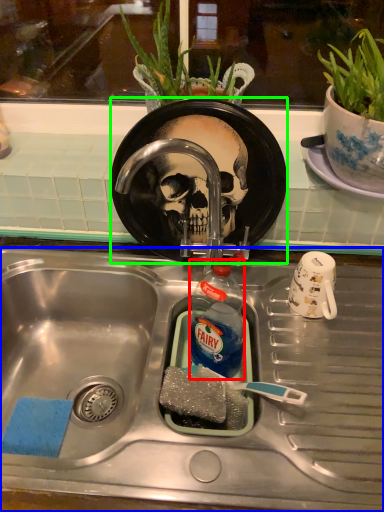
Question: Based on their relative distances, which object is nearer to bottle (highlighted by a red box)? Choose from sink (highlighted by a blue box) and plate (highlighted by a green box).

Choices:
 (A) sink
 (B) plate

Answer: (A)